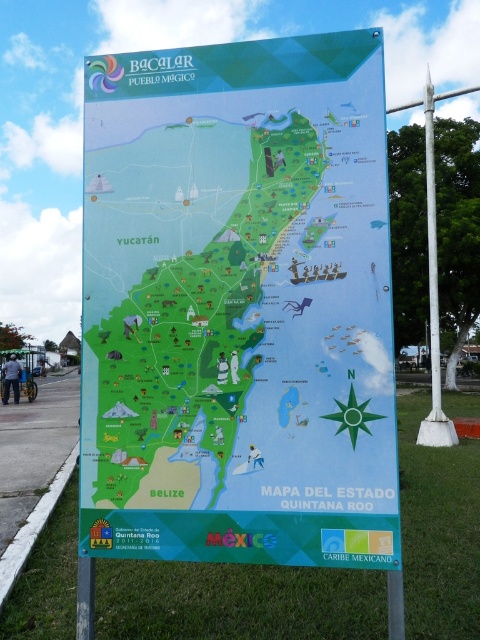
Looking at this image, you are a tourist holding a 1.2 meter wide backpack and want to place it next to the green paper map at center and the white metallic pole at right. Considering their widths, can you fit your backpack between them without overlapping?

The green paper map at center has a lesser width compared to the white metallic pole at right. Since the backpack is 1.2 meters wide, it depends on the combined space between the two objects. However, the description only specifies the relative widths, not the distance between them. Without knowing the exact spacing, it is uncertain if the backpack will fit.

You are holding a compass and standing at the center of the map displayed at point (239, 305). If you walk north from this point, which direction would you be heading relative to the map?

Since the map is oriented with north at the top, walking north from the green paper map at center would mean moving upward on the map towards the top edge.